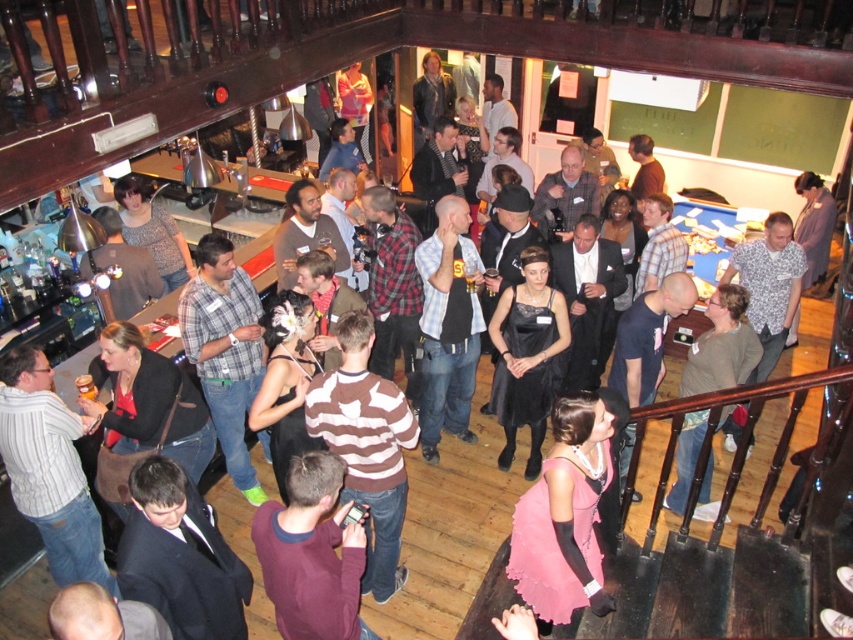
Between checkered fabric shirt at center and black satin dress at center, which one has less height?

black satin dress at center is shorter.

In the scene shown: Which is more to the left, checkered fabric shirt at center or black satin dress at center?

checkered fabric shirt at center is more to the left.

Does point (437, 326) come closer to viewer compared to point (544, 292)?

No, (437, 326) is behind (544, 292).

The image size is (853, 640). Find the location of `checkered fabric shirt at center`. checkered fabric shirt at center is located at coordinates (448, 324).

Who is more forward, (592, 468) or (422, 268)?

Point (592, 468)

Between point (585, 467) and point (450, 214), which one is positioned behind?

Positioned behind is point (450, 214).

Where is `pink satin dress at center`? pink satin dress at center is located at coordinates (566, 513).

Which is below, pink satin dress at center or black satin dress at center?

pink satin dress at center

Does pink satin dress at center have a larger size compared to black satin dress at center?

No, pink satin dress at center is not bigger than black satin dress at center.

Which is behind, point (520, 497) or point (518, 324)?

Point (518, 324)

You are a GUI agent. You are given a task and a screenshot of the screen. Output one action in this format:
    pyautogui.click(x=<x>, y=<y>)
    Task: Click on the pink satin dress at center
    
    Given the screenshot: What is the action you would take?
    [566, 513]